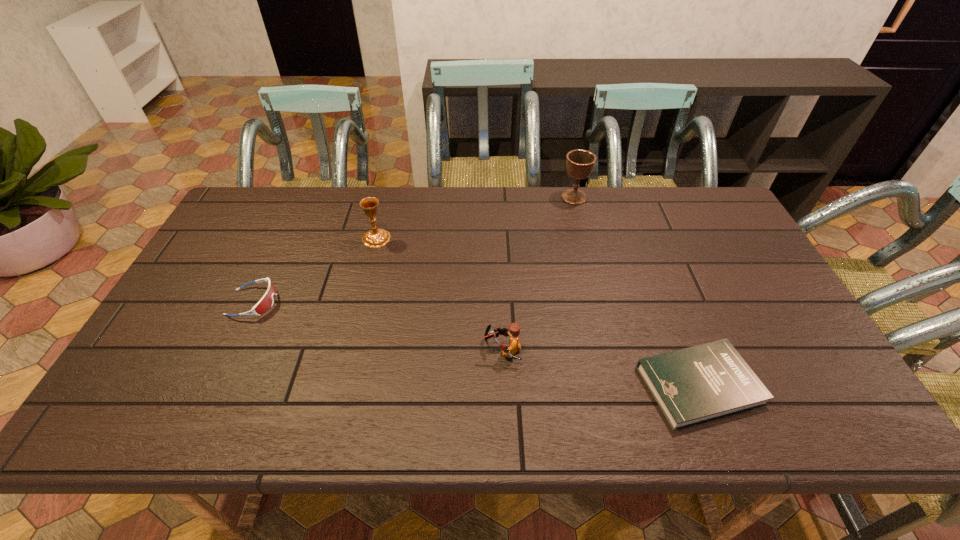
You are a GUI agent. You are given a task and a screenshot of the screen. Output one action in this format:
    pyautogui.click(x=<x>, y=<y>)
    Task: Click on the vacant space located on the left of the fourth nearest object
    This screenshot has width=960, height=540.
    Given the screenshot: What is the action you would take?
    pyautogui.click(x=301, y=238)

Locate an element on the screen. The image size is (960, 540). vacant space located 0.260m holding a crossbow in the hands of the third object from left to right is located at coordinates (379, 349).

Locate an element on the screen. vacant space situated 0.210m holding a crossbow in the hands of the third object from left to right is located at coordinates (399, 349).

Locate an element on the screen. This screenshot has width=960, height=540. vacant position located 0.350m holding a crossbow in the hands of the third object from left to right is located at coordinates (343, 349).

Where is `free space located 0.400m on the front-facing side of the leftmost object`? free space located 0.400m on the front-facing side of the leftmost object is located at coordinates (424, 302).

In order to click on vacant space located on the left of the shortest object in this screenshot , I will do `click(606, 385)`.

Image resolution: width=960 pixels, height=540 pixels. In order to click on object that is at the near edge in this screenshot , I will do `click(700, 383)`.

Where is `object present at the left edge`? The image size is (960, 540). object present at the left edge is located at coordinates (266, 302).

This screenshot has width=960, height=540. What are the coordinates of `vacant region at the far edge of the desktop` in the screenshot? It's located at (370, 229).

Identify the location of vacant space at the near edge of the desktop. Image resolution: width=960 pixels, height=540 pixels. (708, 425).